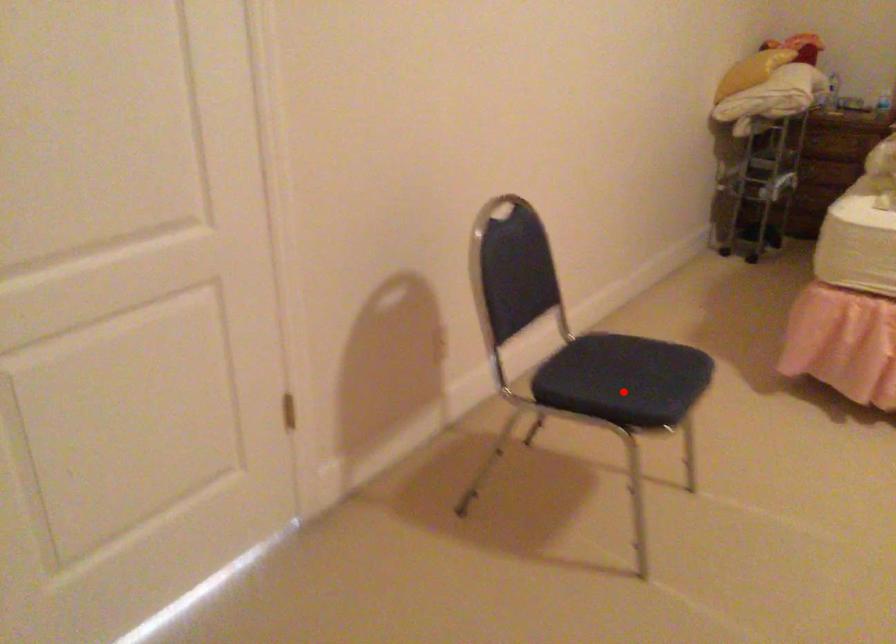
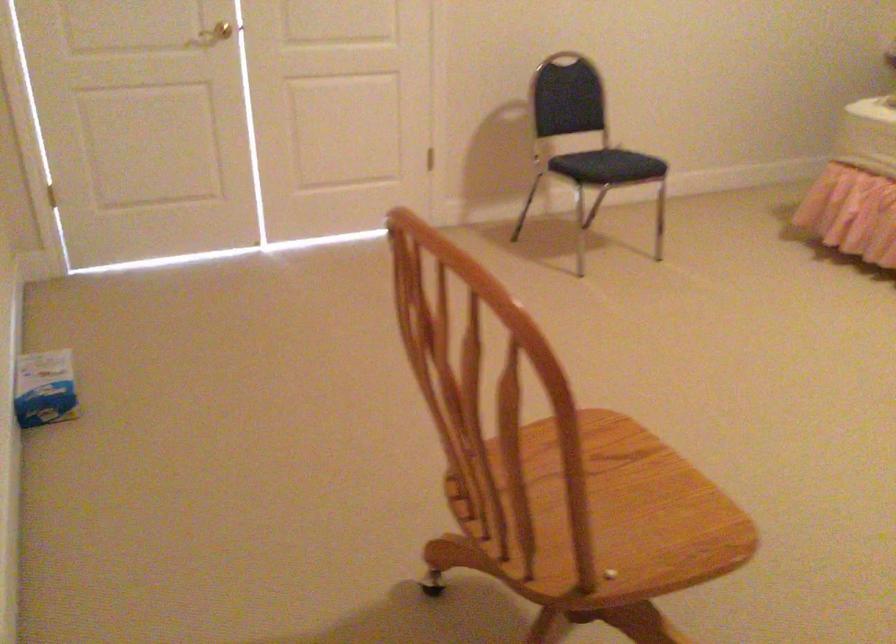
Question: A red point is marked in image1. In image2, is the corresponding 3D point closer to the camera or farther? Reply with the corresponding letter.

Choices:
 (A) The corresponding 3D point is closer.
 (B) The corresponding 3D point is farther.

Answer: (B)